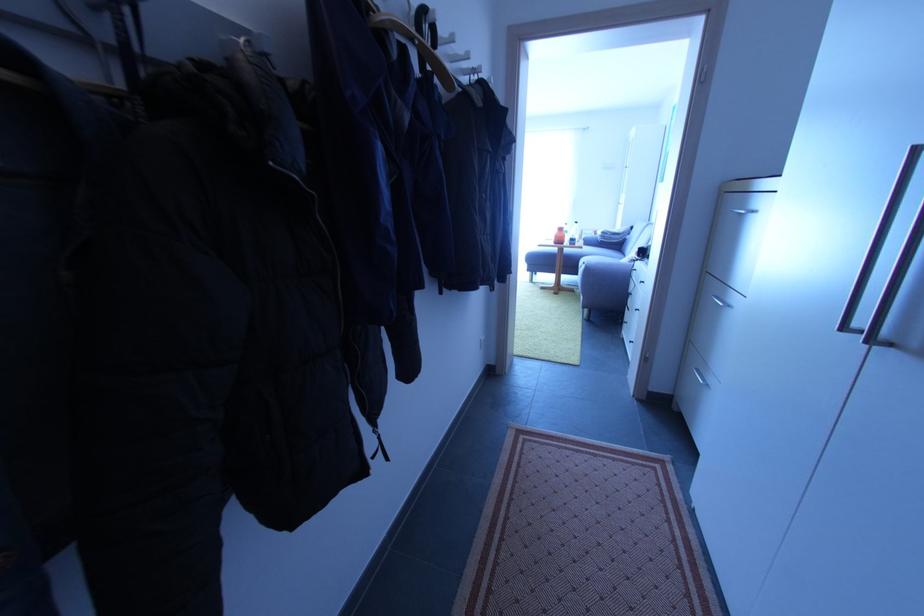
Find where to pull the black zipper pull. Please return your answer as a coordinate pair (x, y).

(378, 442)